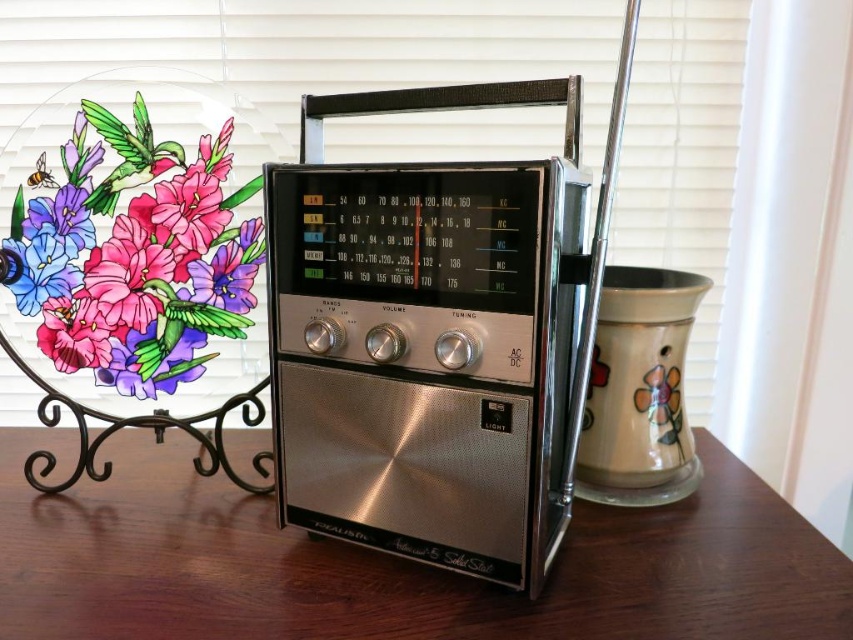
This screenshot has width=853, height=640. What do you see at coordinates (421, 356) in the screenshot?
I see `silver metallic radio at center` at bounding box center [421, 356].

Does silver metallic radio at center have a greater height compared to matte glass plate with floral design at left?

Indeed, silver metallic radio at center has a greater height compared to matte glass plate with floral design at left.

Does point (378, 474) come farther from viewer compared to point (67, 209)?

No.

Where is `silver metallic radio at center`? The height and width of the screenshot is (640, 853). silver metallic radio at center is located at coordinates (421, 356).

Does satin wood table at center have a larger size compared to matte glass plate with floral design at left?

Yes.

Is point (544, 627) in front of point (102, 250)?

Yes, point (544, 627) is closer to viewer.

Identify the location of satin wood table at center. (392, 564).

Is point (379, 296) farther from viewer compared to point (38, 524)?

No, it is not.

Identify the location of silver metallic radio at center. (421, 356).